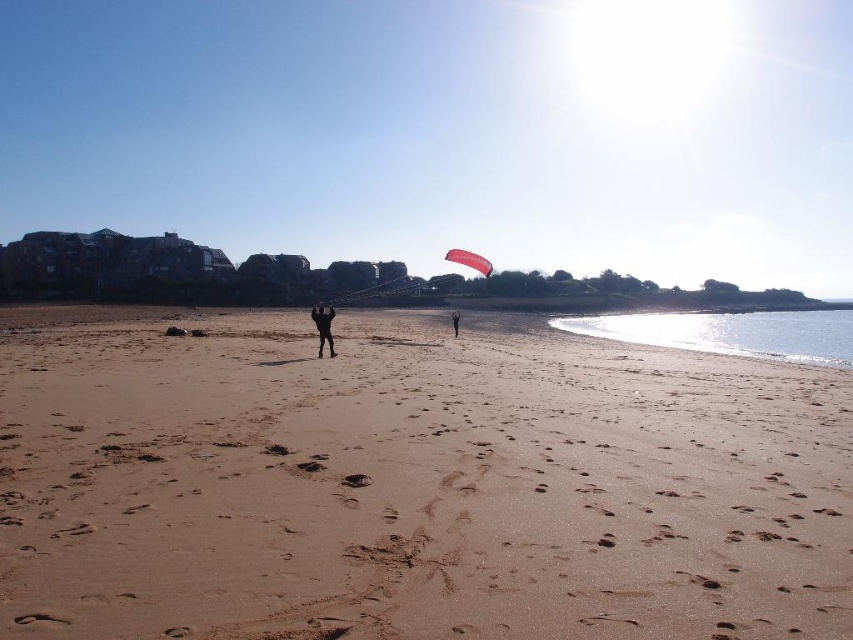
Question: Which point is closer to the camera?

Choices:
 (A) black fabric person at center
 (B) smooth sand at center
 (C) black fabric kite at center

Answer: (B)

Question: Observing the image, what is the correct spatial positioning of smooth sand at center in reference to black fabric person at center?

Choices:
 (A) above
 (B) below

Answer: (B)

Question: Among these objects, which one is nearest to the camera?

Choices:
 (A) black fabric kite at center
 (B) white glossy parachute at center

Answer: (A)

Question: Can you confirm if smooth sand at center is positioned above white glossy parachute at center?

Choices:
 (A) yes
 (B) no

Answer: (B)

Question: Can you confirm if smooth sand at center is smaller than black fabric kite at center?

Choices:
 (A) no
 (B) yes

Answer: (A)

Question: Which point appears farthest from the camera in this image?

Choices:
 (A) (457, 253)
 (B) (457, 312)
 (C) (312, 317)
 (D) (415, 524)

Answer: (A)